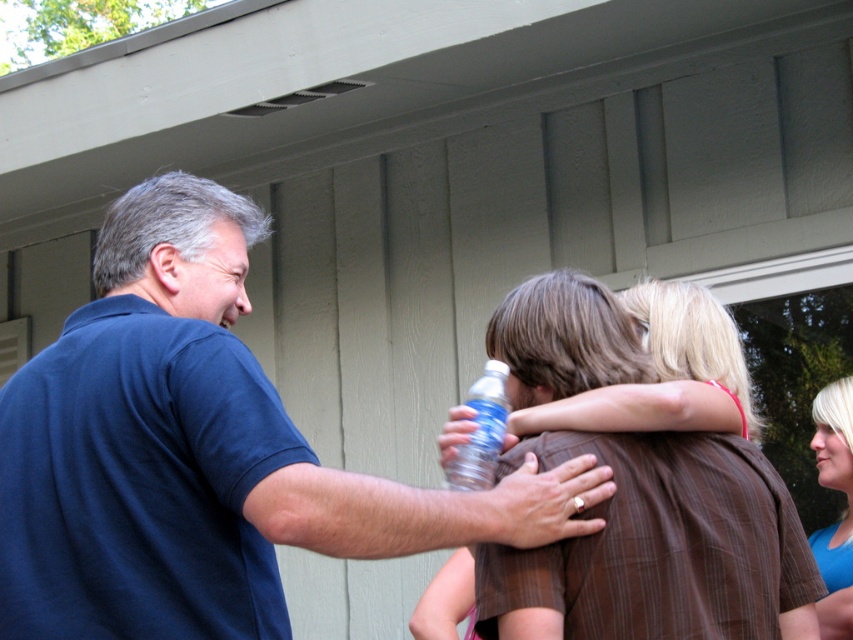
You are standing in front of the house and want to find the blue cotton shirt at center. According to the scene description, where should you look to locate it?

The blue cotton shirt at center is located at point (200, 452), so you should look there to find it.

You are trying to determine if the blonde hair at center can be used to hide the clear plastic bottle at center from view. Based on their sizes, is this possible?

The blonde hair at center is wider than the clear plastic bottle at center, so it is possible to use the blonde hair at center to hide the clear plastic bottle at center from view.